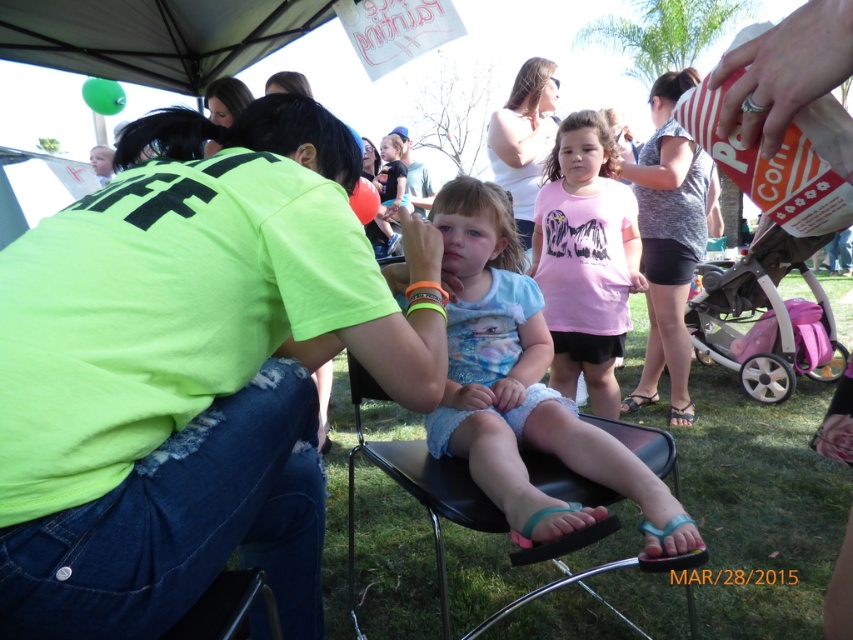
You are a photographer standing at the edge of the event area. You want to take a photo of the pink matte shirt at center and the pink fabric baby carriage at right. How far apart are these two objects in feet?

The pink matte shirt at center is 4.42 feet from the pink fabric baby carriage at right.

You are a photographer at the event and want to capture a photo that includes both the pink matte shirt at center and the pink fabric baby carriage at right. Based on their positions, which object should you focus on first to ensure both are in the frame?

The pink matte shirt at center is located above the pink fabric baby carriage at right, so focus on the pink matte shirt at center first to ensure both are in the frame.